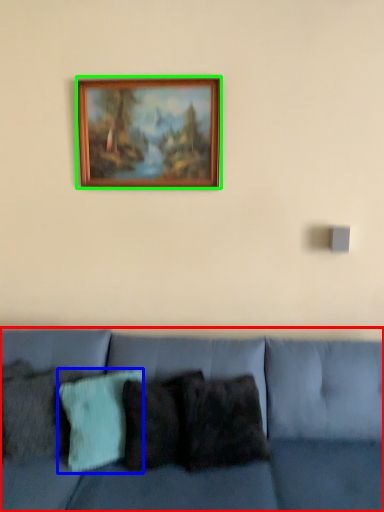
Question: Considering the real-world distances, which object is farthest from studio couch (highlighted by a red box)? pillow (highlighted by a blue box) or picture frame (highlighted by a green box)?

Choices:
 (A) pillow
 (B) picture frame

Answer: (B)